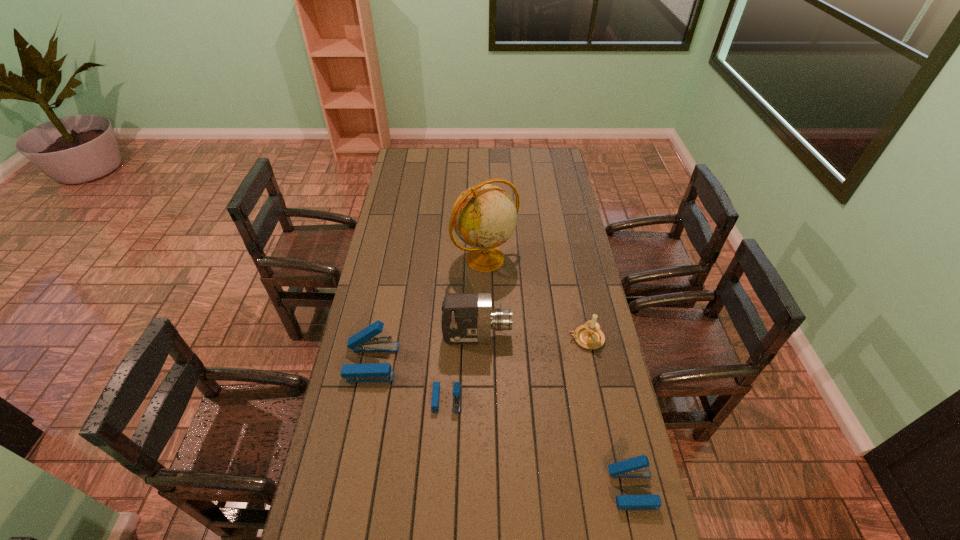
I want to click on vacant space located on the back of the leftmost object, so click(385, 296).

I want to click on free location located on the front of the second nearest object, so click(443, 471).

Where is `free spot located on the left of the nearest object`? The image size is (960, 540). free spot located on the left of the nearest object is located at coordinates (521, 489).

Find the location of a particular element. The height and width of the screenshot is (540, 960). free space located 0.080m on the left of the farthest object is located at coordinates (434, 259).

Find the location of a particular element. The height and width of the screenshot is (540, 960). free space located 0.240m at the front of the fifth shortest object, highlighting the lens is located at coordinates (576, 336).

What are the coordinates of `vacant region located with a handle on the side of the candle holder` in the screenshot? It's located at (480, 339).

Identify the location of vacant space located 0.110m with a handle on the side of the candle holder. (538, 339).

At what (x,y) coordinates should I click in order to perform the action: click on vacant position located 0.270m with a handle on the side of the candle holder. Please return your answer as a coordinate pair (x, y). This screenshot has height=540, width=960. Looking at the image, I should click on (493, 339).

Image resolution: width=960 pixels, height=540 pixels. I want to click on object that is at the near edge, so click(x=637, y=467).

The image size is (960, 540). Find the location of `object that is positioned at the left edge`. object that is positioned at the left edge is located at coordinates (364, 341).